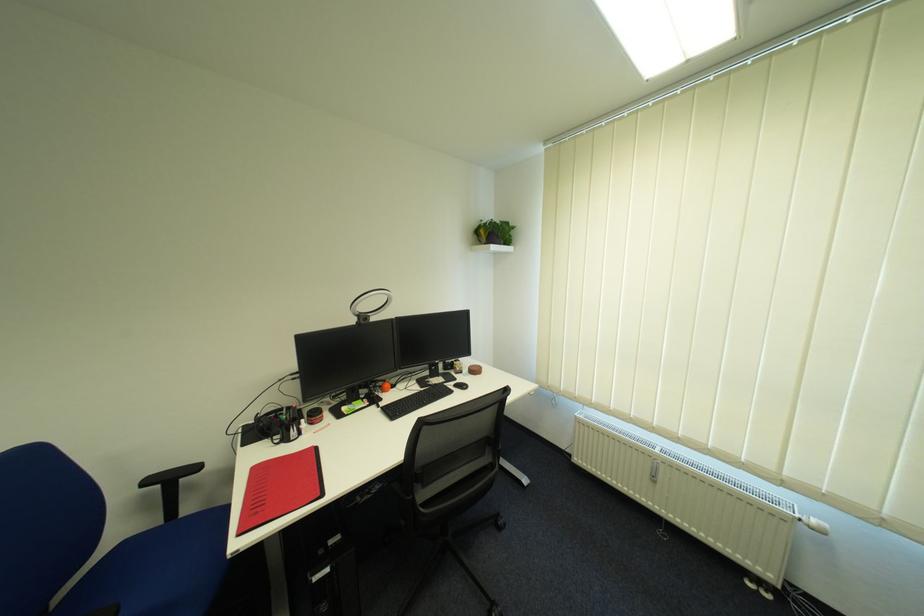
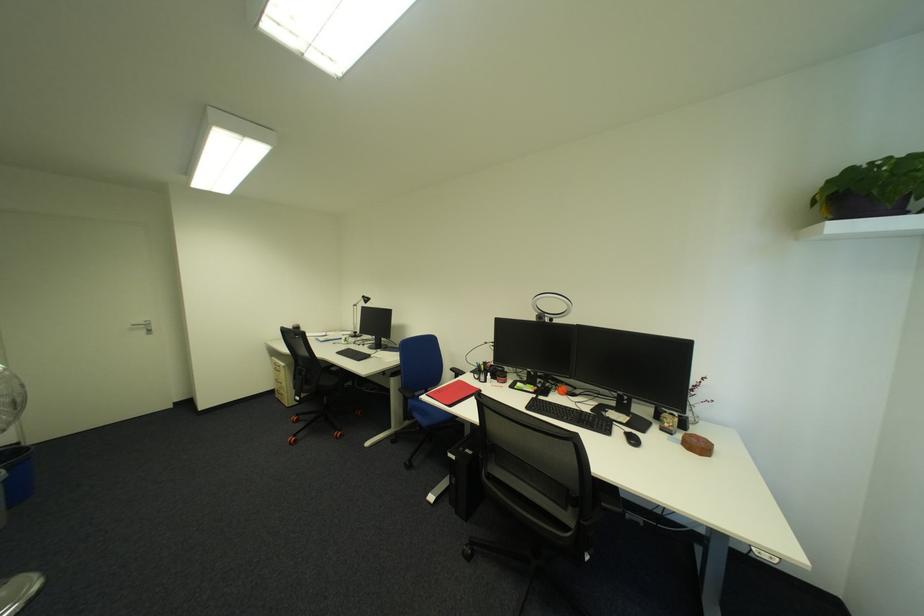
In the second image, find the point that corresponds to point (362, 322) in the first image.

(542, 318)